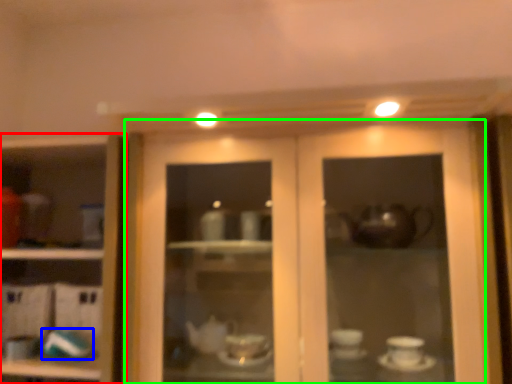
Question: Considering the real-world distances, which object is closest to cupboard (highlighted by a red box)? tableware (highlighted by a blue box) or door (highlighted by a green box).

Choices:
 (A) tableware
 (B) door

Answer: (A)